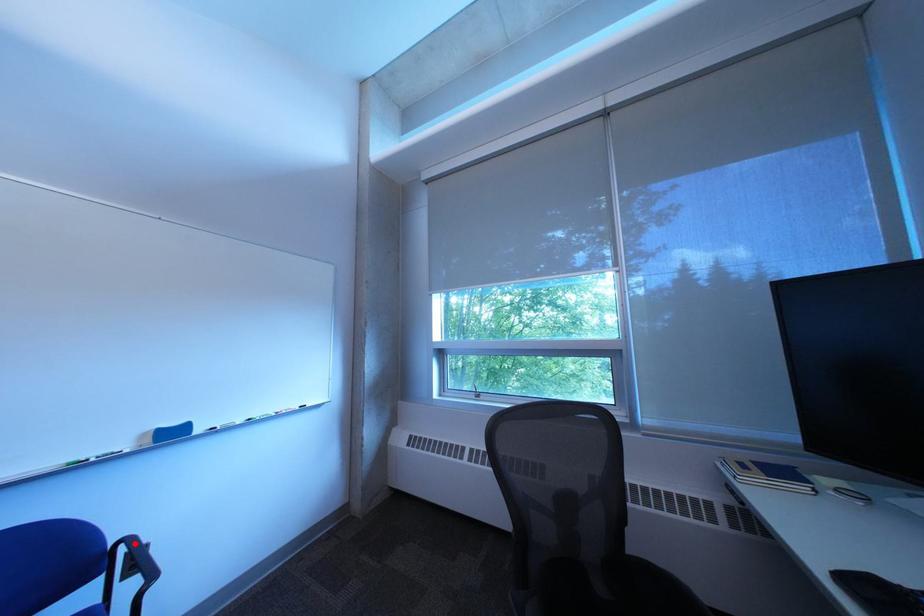
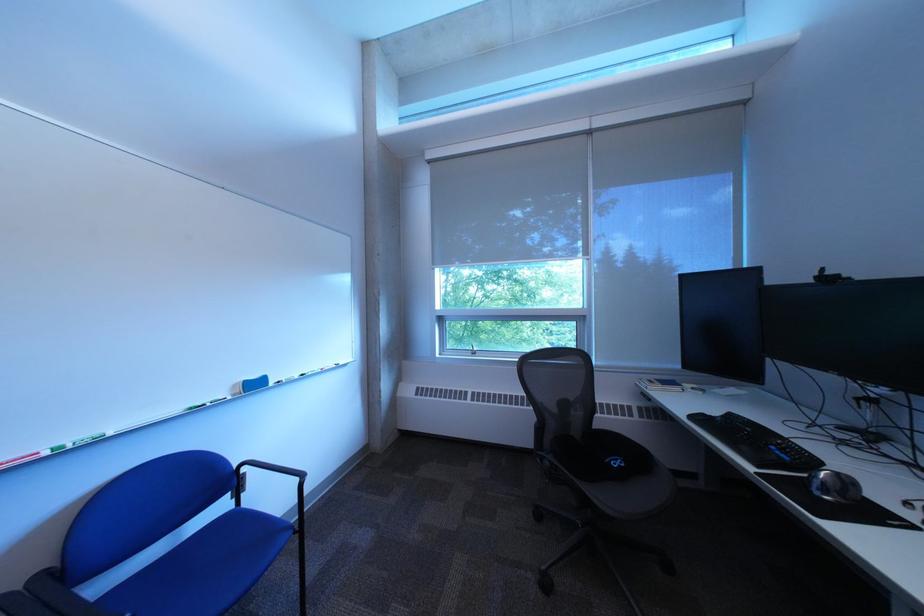
Find the pixel in the second image that matches the highlighted location in the first image.

(257, 467)